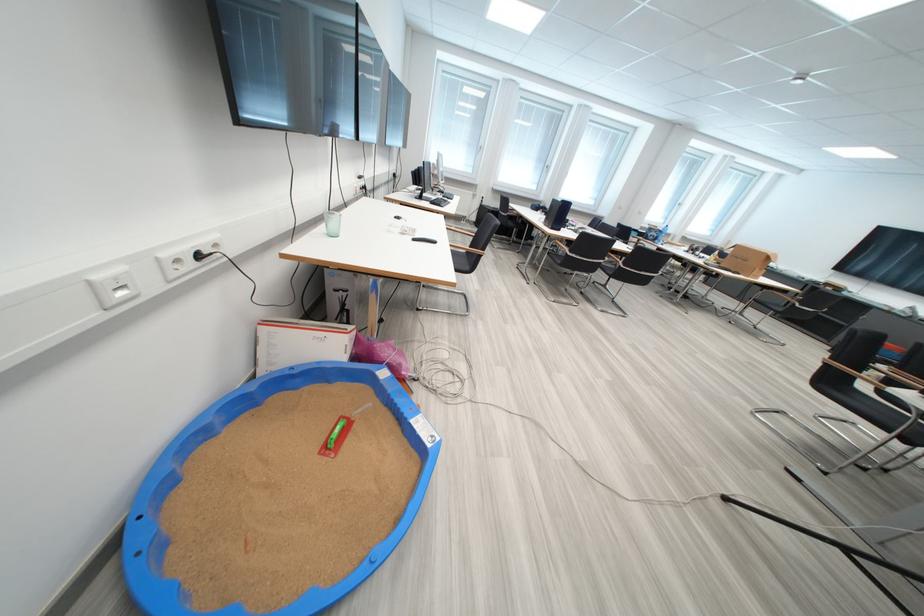
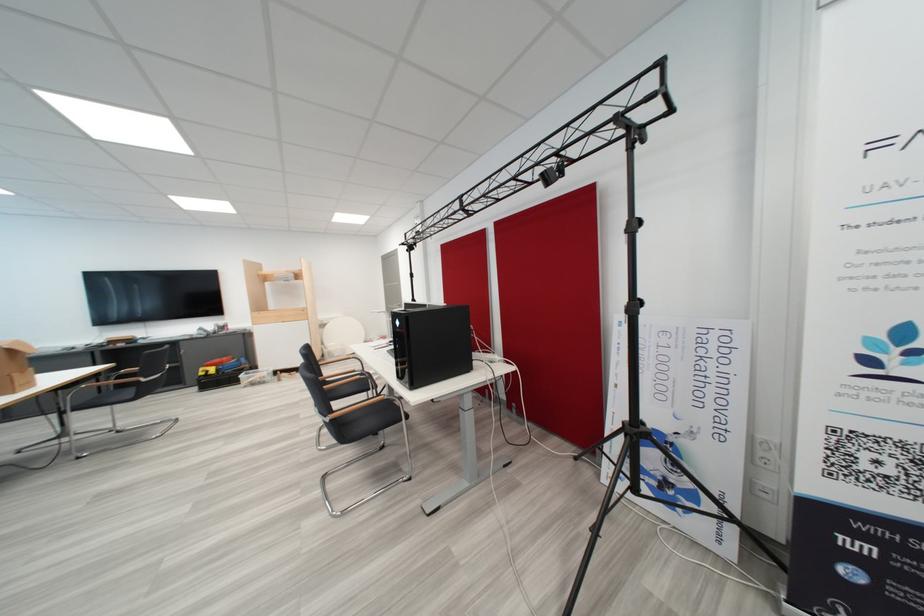
In the second image, find the point that corresponds to the point at 841,386 in the first image.

(355, 430)